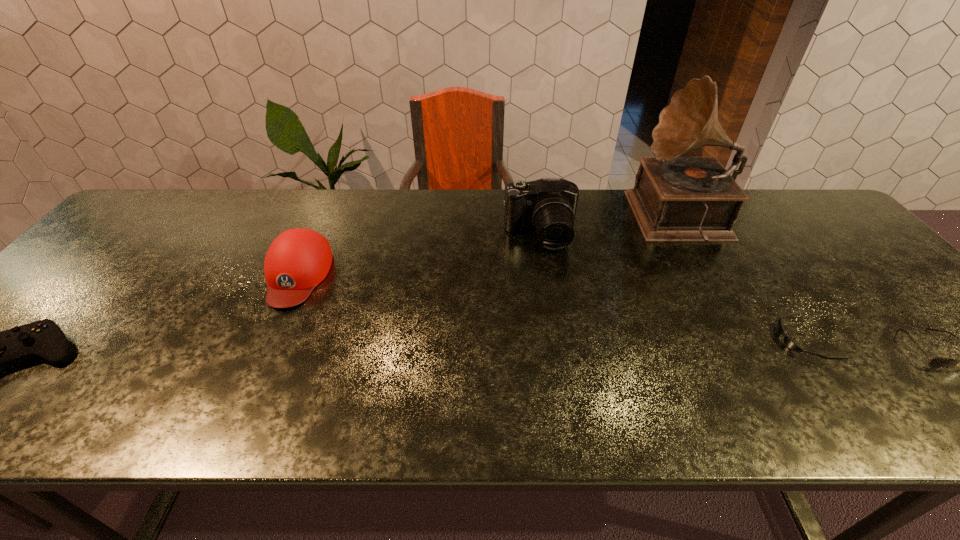
Where is `free space at the right edge of the desktop`? The height and width of the screenshot is (540, 960). free space at the right edge of the desktop is located at coordinates (869, 325).

Image resolution: width=960 pixels, height=540 pixels. I want to click on vacant point located between the record player and the shorter sunglasses, so click(x=742, y=280).

Locate an element on the screen. The image size is (960, 540). vacant area between the fifth object from right to left and the fifth shortest object is located at coordinates click(x=419, y=255).

This screenshot has width=960, height=540. What are the coordinates of `free spot between the baseball cap and the camera` in the screenshot? It's located at (419, 255).

Locate an element on the screen. The width and height of the screenshot is (960, 540). object identified as the fifth closest to the baseball cap is located at coordinates (938, 362).

You are a GUI agent. You are given a task and a screenshot of the screen. Output one action in this format:
    pyautogui.click(x=<x>, y=<y>)
    Task: Click on the object that stands as the second closest to the baseball cap
    The height and width of the screenshot is (540, 960).
    Given the screenshot: What is the action you would take?
    pyautogui.click(x=548, y=205)

Where is `free region that satisfies the following two spatial constraints: 1. from the horn of the tallest object; 2. on the lens of the third object from left to right`? This screenshot has width=960, height=540. free region that satisfies the following two spatial constraints: 1. from the horn of the tallest object; 2. on the lens of the third object from left to right is located at coordinates (690, 235).